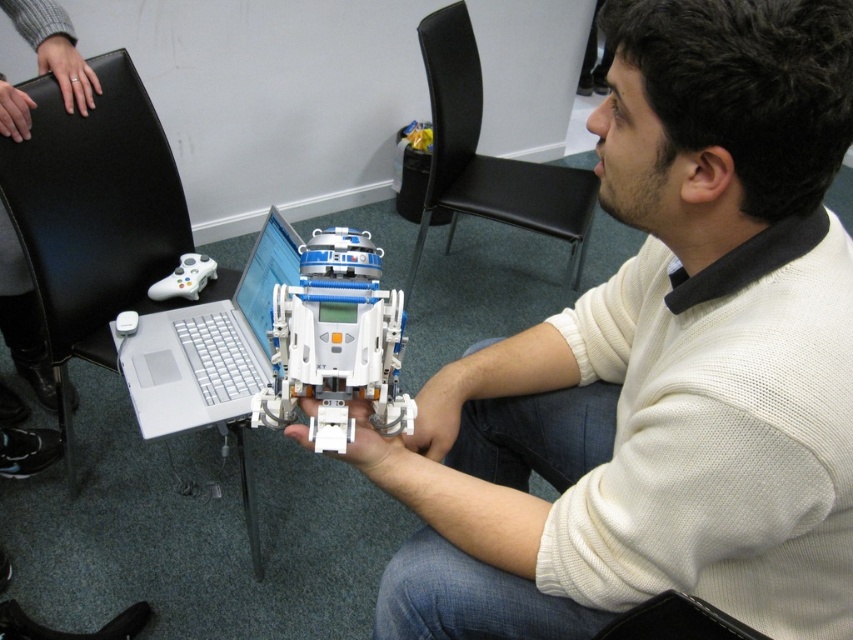
Question: Which point appears closest to the camera in this image?

Choices:
 (A) (231, 420)
 (B) (622, 618)
 (C) (428, 28)
 (D) (506, 577)

Answer: (B)

Question: Which object is the closest to the white matte robot at center?

Choices:
 (A) black leather chair at left
 (B) black leather chair at upper center
 (C) silver metallic laptop at center
 (D) black fabric chair at lower right

Answer: (D)

Question: Does black leather chair at left lie behind silver metallic laptop at center?

Choices:
 (A) no
 (B) yes

Answer: (B)

Question: Among these objects, which one is nearest to the camera?

Choices:
 (A) white matte robot at center
 (B) black fabric chair at lower right

Answer: (A)

Question: Does silver metallic laptop at center lie in front of black leather chair at upper center?

Choices:
 (A) yes
 (B) no

Answer: (A)

Question: Does white matte robot at center have a larger size compared to black leather chair at left?

Choices:
 (A) yes
 (B) no

Answer: (A)